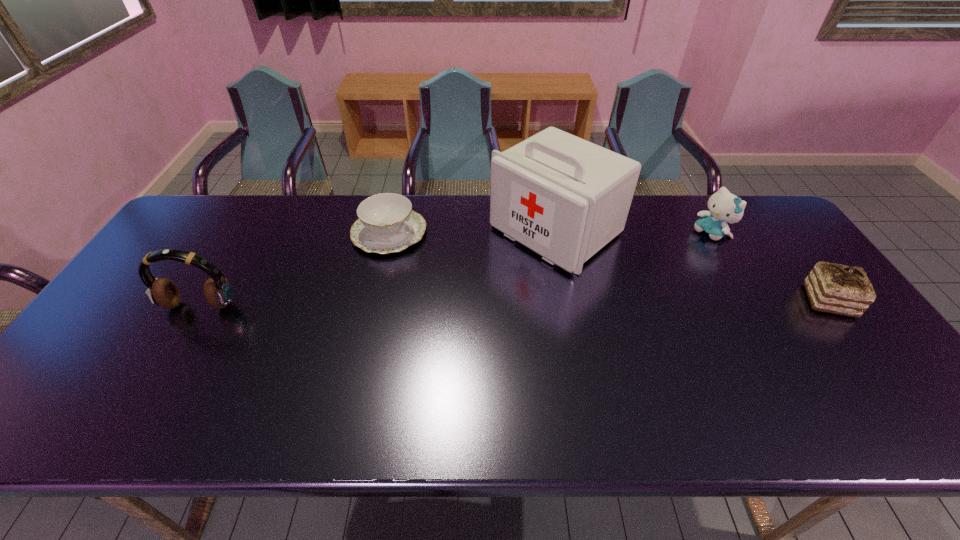
This screenshot has width=960, height=540. In order to click on the leftmost object in this screenshot , I will do `click(218, 292)`.

Find the location of `headset`. headset is located at coordinates (218, 292).

At what (x,y) coordinates should I click in order to perform the action: click on chocolate cake. Please return your answer as a coordinate pair (x, y). The image size is (960, 540). Looking at the image, I should click on (834, 288).

Where is `the third object from left to right`? the third object from left to right is located at coordinates (565, 198).

At what (x,y) coordinates should I click in order to perform the action: click on the tallest object. Please return your answer as a coordinate pair (x, y). The width and height of the screenshot is (960, 540). Looking at the image, I should click on (565, 198).

Find the location of a particular element. The width and height of the screenshot is (960, 540). the third shortest object is located at coordinates (724, 207).

Find the location of a particular element. This screenshot has height=540, width=960. kitten is located at coordinates (724, 207).

The image size is (960, 540). I want to click on the second object from left to right, so click(x=387, y=223).

The height and width of the screenshot is (540, 960). Identify the location of free space located on the ear cup of the leftmost object. (182, 336).

The height and width of the screenshot is (540, 960). Identify the location of blank area located on the back of the chocolate cake. (761, 210).